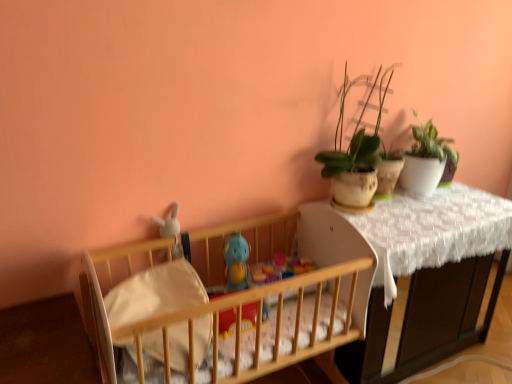
The width and height of the screenshot is (512, 384). Find the location of `vacant space in front of green matte plant at upper right, marked as the first houseplant in a right-to-left arrangement`. vacant space in front of green matte plant at upper right, marked as the first houseplant in a right-to-left arrangement is located at coordinates (436, 208).